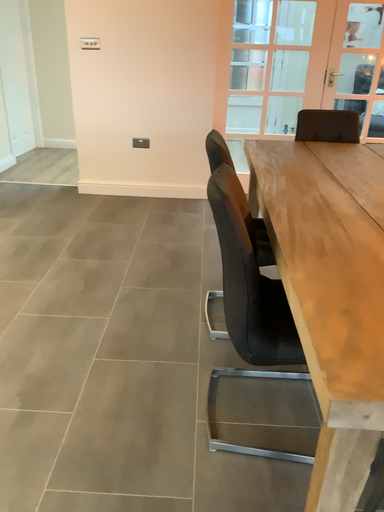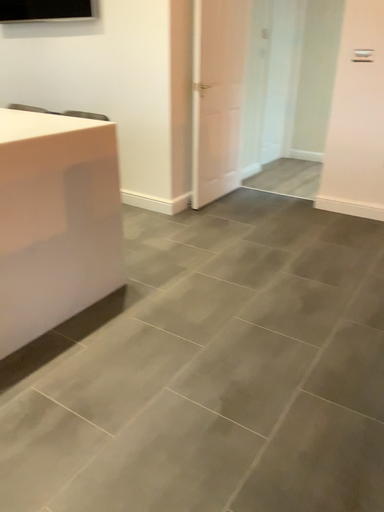
Question: Which way did the camera rotate in the video?

Choices:
 (A) rotated left
 (B) rotated right

Answer: (A)